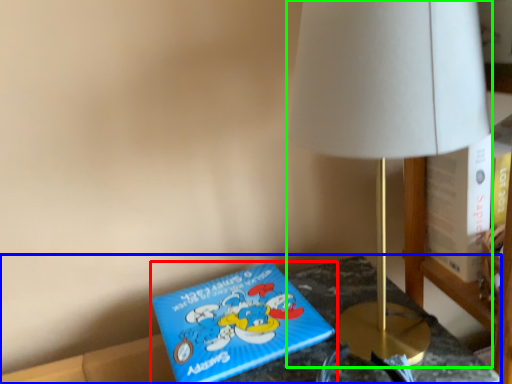
Question: Considering the real-world distances, which object is closest to book (highlighted by a red box)? furniture (highlighted by a blue box) or lamp (highlighted by a green box).

Choices:
 (A) furniture
 (B) lamp

Answer: (A)